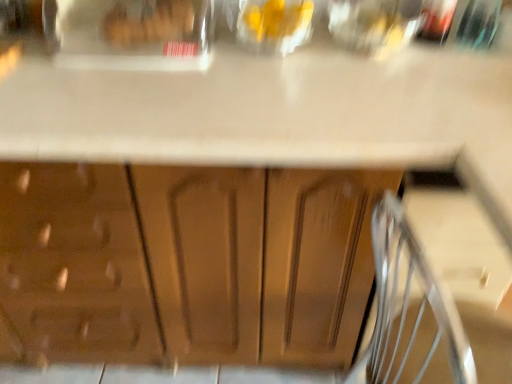
What is the approximate height of wooden cabinet at center?

wooden cabinet at center is 87.83 centimeters in height.

The width and height of the screenshot is (512, 384). What do you see at coordinates (217, 269) in the screenshot? I see `wooden cabinet at center` at bounding box center [217, 269].

The image size is (512, 384). Find the location of `wooden cabinet at center`. wooden cabinet at center is located at coordinates (217, 269).

Image resolution: width=512 pixels, height=384 pixels. I want to click on wooden cabinet at center, so click(x=217, y=269).